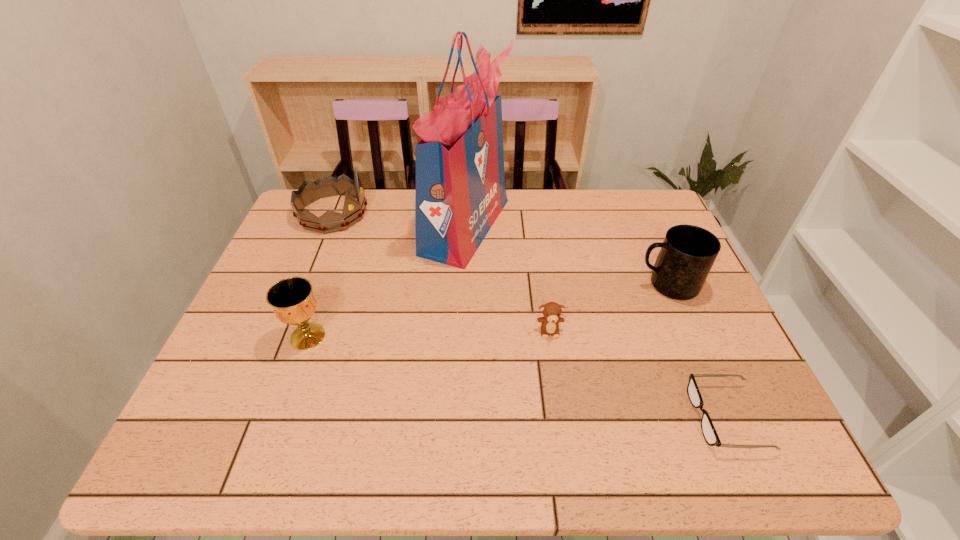
Locate an element on the screen. This screenshot has height=540, width=960. free space located 0.330m at the front of the tiara with jewels is located at coordinates (470, 213).

I want to click on free space located 0.360m on the side of the mug with the handle, so click(x=502, y=285).

Image resolution: width=960 pixels, height=540 pixels. I want to click on free spot located on the side of the mug with the handle, so click(547, 285).

In order to click on free space located on the side of the mug with the handle in this screenshot , I will do `click(540, 285)`.

Where is `free space located 0.110m on the front of the chalice`? free space located 0.110m on the front of the chalice is located at coordinates (287, 394).

You are a GUI agent. You are given a task and a screenshot of the screen. Output one action in this format:
    pyautogui.click(x=<x>, y=<y>)
    Task: Click on the free location located on the face of the fourth object from left to right
    Image resolution: width=960 pixels, height=540 pixels.
    Given the screenshot: What is the action you would take?
    pyautogui.click(x=558, y=390)

Identify the location of free space located on the front-facing side of the spectacles. (608, 417).

Where is `vacant area situated on the front-facing side of the spectacles`? The image size is (960, 540). vacant area situated on the front-facing side of the spectacles is located at coordinates (627, 417).

At what (x,y) coordinates should I click in order to perform the action: click on vacant space located 0.170m on the front-facing side of the spectacles. Please return your answer as a coordinate pair (x, y). Looking at the image, I should click on (612, 417).

Find the location of a particular element. This screenshot has width=960, height=540. grocery bag that is at the far edge is located at coordinates tap(460, 191).